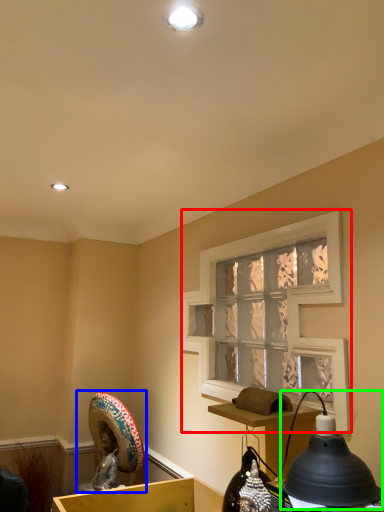
Question: Which object is positioned farthest from window screen (highlighted by a red box)? Select from sculpture (highlighted by a blue box) and lamp (highlighted by a green box).

Choices:
 (A) sculpture
 (B) lamp

Answer: (A)